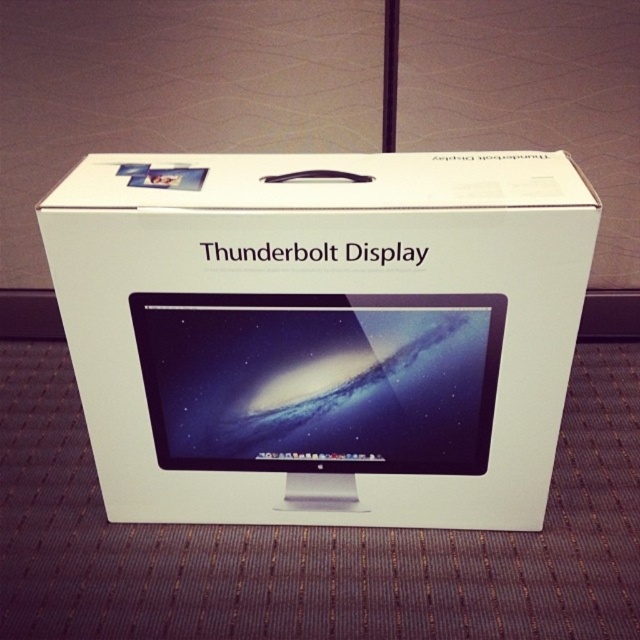
Question: Is white matte cardboard box at center positioned at the back of satin black monitor at center?

Choices:
 (A) yes
 (B) no

Answer: (B)

Question: Does white matte cardboard box at center come behind satin black monitor at center?

Choices:
 (A) yes
 (B) no

Answer: (B)

Question: Does white matte cardboard box at center lie in front of satin black monitor at center?

Choices:
 (A) no
 (B) yes

Answer: (B)

Question: Which point is farther to the camera?

Choices:
 (A) (58, 236)
 (B) (451, 368)

Answer: (B)

Question: Which point is farther to the camera?

Choices:
 (A) satin black monitor at center
 (B) white matte cardboard box at center

Answer: (A)